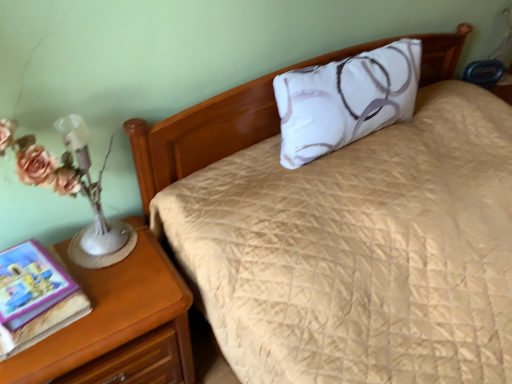
At what (x,y) coordinates should I click in order to perform the action: click on empty space that is ontop of wooden nightstand at lower left (from a real-world perspective). Please return your answer as a coordinate pair (x, y). The height and width of the screenshot is (384, 512). Looking at the image, I should click on (98, 287).